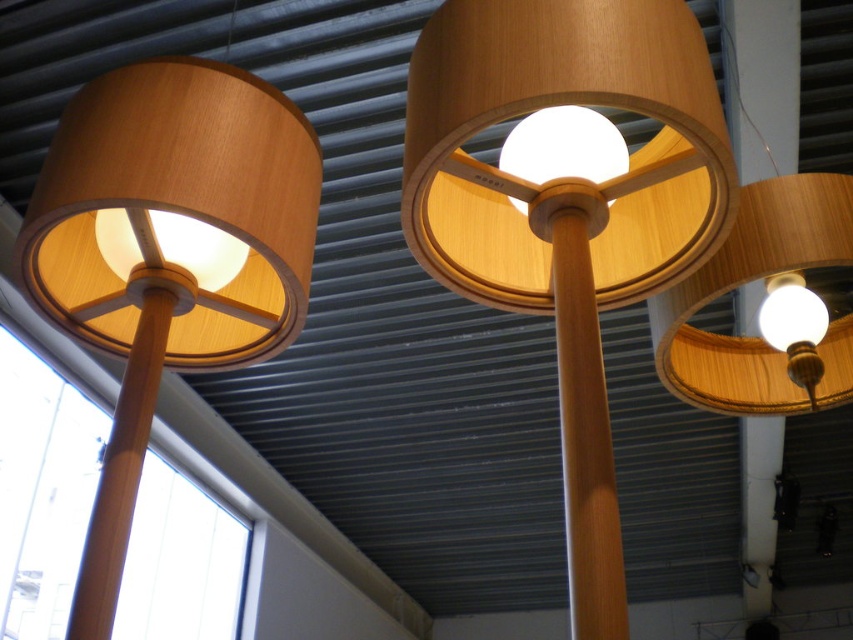
You are standing in the room and want to reach the wooden lampshade at center to adjust its light bulb. If your maximum arm reach is 28 inches, can you comfortably reach it?

The wooden lampshade at center is 29.77 inches away from the viewer, which is slightly beyond your maximum arm reach of 28 inches. You might need a small stool or step to comfortably adjust the light bulb.